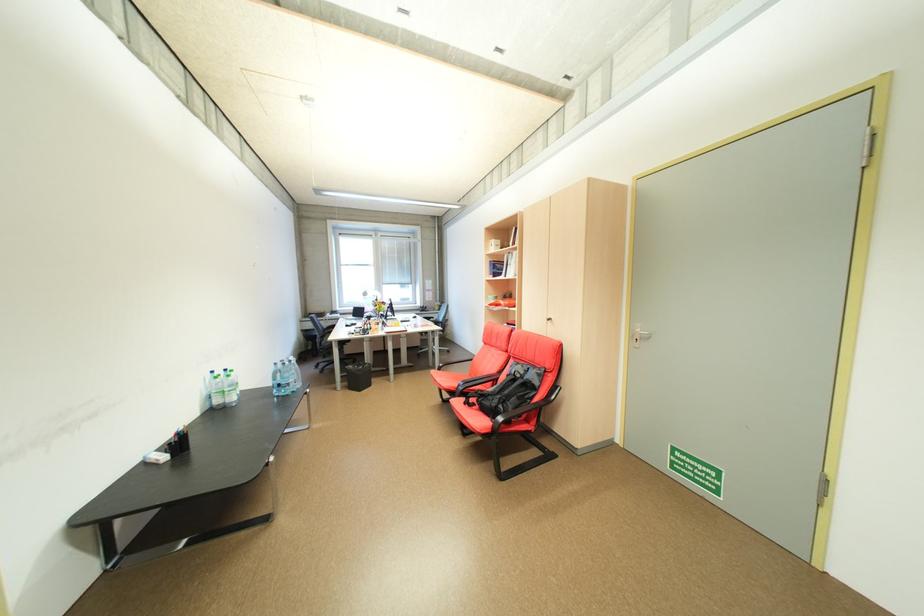
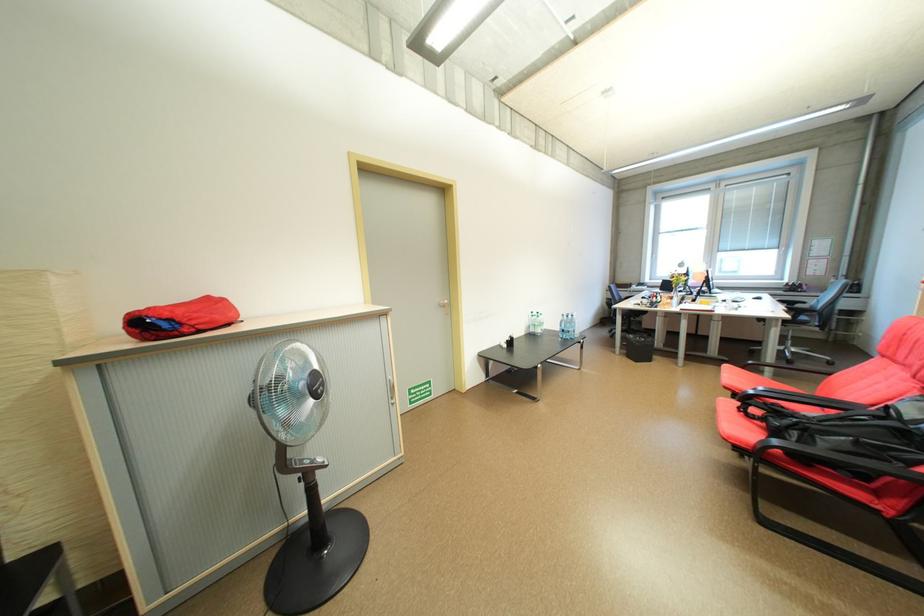
Question: The camera is either moving clockwise (left) or counter-clockwise (right) around the object. The first image is from the beginning of the video and the second image is from the end. Is the camera moving left or right when shooting the video?

Choices:
 (A) Left
 (B) Right

Answer: (B)